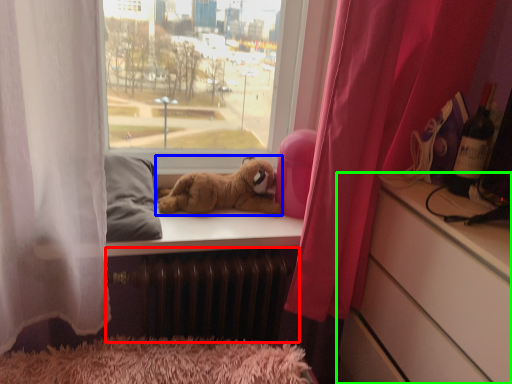
Question: Based on their relative distances, which object is nearer to radiator (highlighted by a red box)? Choose from dog (highlighted by a blue box) and cabinetry (highlighted by a green box).

Choices:
 (A) dog
 (B) cabinetry

Answer: (A)